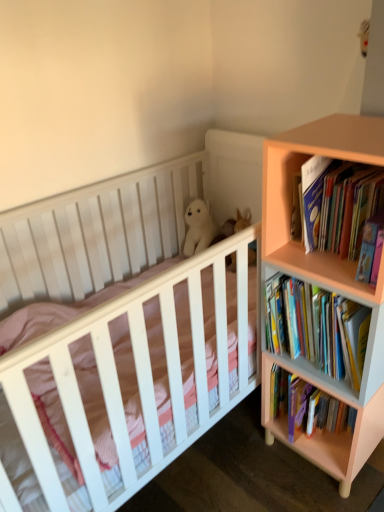
Question: Considering the positions of point (342, 372) and point (301, 160), is point (342, 372) closer or farther from the camera than point (301, 160)?

Choices:
 (A) closer
 (B) farther

Answer: (B)

Question: From the image's perspective, is hardcover books at right, placed as the 1th book when sorted from bottom to top, above or below pink matte bookcase at right?

Choices:
 (A) above
 (B) below

Answer: (A)

Question: Considering the real-world distances, which object is farthest from the hardcover books at right, the second book from the top?

Choices:
 (A) white plush bear at center
 (B) white matte crib at center
 (C) hardcover book at right, which is the second book in bottom-to-top order
 (D) white plush bear at upper center
 (E) pink matte bookcase at right

Answer: (A)

Question: Which object is positioned farthest from the white plush bear at center?

Choices:
 (A) hardcover book at right, which is the second book in bottom-to-top order
 (B) white plush bear at upper center
 (C) white matte crib at center
 (D) hardcover books at right, placed as the 1th book when sorted from bottom to top
 (E) pink matte bookcase at right

Answer: (A)